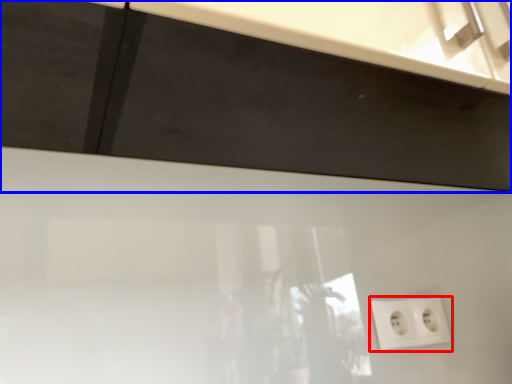
Question: Which point is closer to the camera, power plugs and sockets (highlighted by a red box) or cabinetry (highlighted by a blue box)?

Choices:
 (A) power plugs and sockets
 (B) cabinetry

Answer: (B)